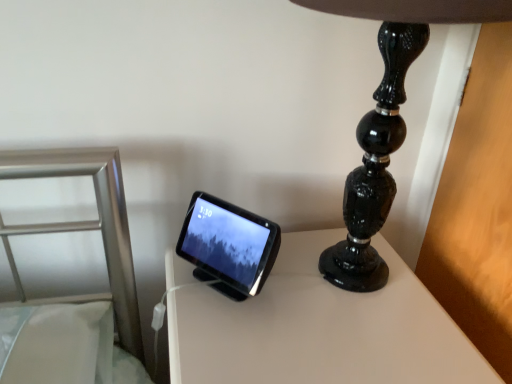
Question: Does point (215, 372) appear closer or farther from the camera than point (228, 244)?

Choices:
 (A) closer
 (B) farther

Answer: (A)

Question: Considering the positions of white glossy table at center and matte black tablet at center in the image, is white glossy table at center bigger or smaller than matte black tablet at center?

Choices:
 (A) small
 (B) big

Answer: (B)

Question: Based on their relative distances, which object is nearer to the matte black tablet at center?

Choices:
 (A) black glossy lamp at upper right
 (B) white glossy table at center

Answer: (B)

Question: Considering the real-world distances, which object is closest to the white glossy table at center?

Choices:
 (A) matte black tablet at center
 (B) black glossy lamp at upper right

Answer: (A)